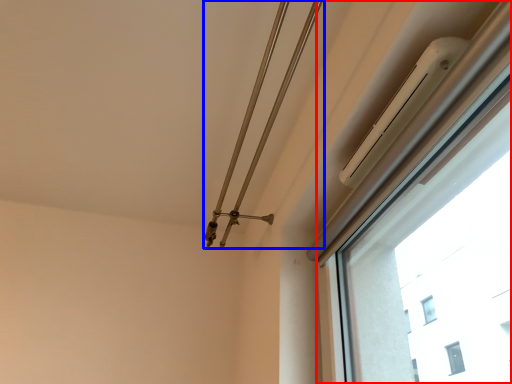
Question: Which object appears farthest to the camera in this image, window (highlighted by a red box) or twin (highlighted by a blue box)?

Choices:
 (A) window
 (B) twin

Answer: (B)